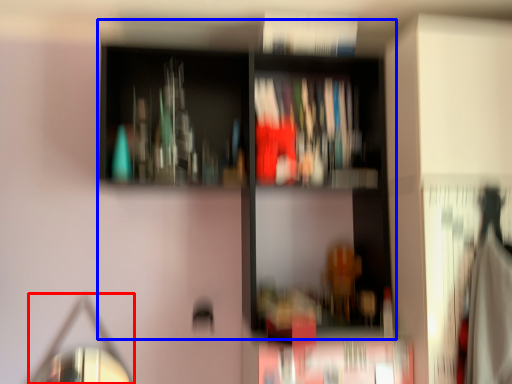
Question: Which object is closer to the camera taking this photo, mirror (highlighted by a red box) or bookcase (highlighted by a blue box)?

Choices:
 (A) mirror
 (B) bookcase

Answer: (B)